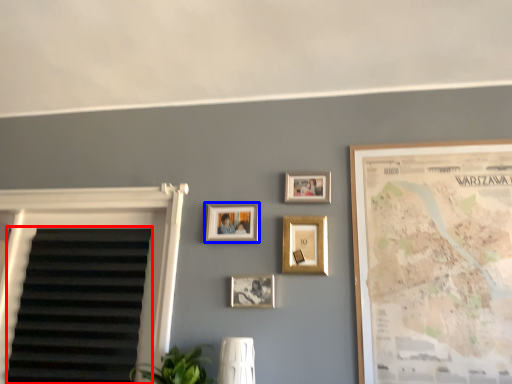
Question: Which object appears closest to the camera in this image, blind (highlighted by a red box) or picture frame (highlighted by a blue box)?

Choices:
 (A) blind
 (B) picture frame

Answer: (A)